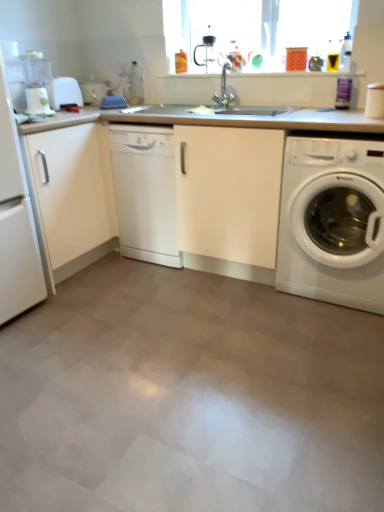
Question: Is white matte countertop at center not close to white matte cabinet at left?

Choices:
 (A) no
 (B) yes

Answer: (A)

Question: Is white matte countertop at center turned away from white matte cabinet at left?

Choices:
 (A) no
 (B) yes

Answer: (A)

Question: From the image's perspective, is white matte countertop at center on white matte cabinet at left?

Choices:
 (A) no
 (B) yes

Answer: (B)

Question: Does white matte countertop at center have a lesser width compared to white matte cabinet at left?

Choices:
 (A) yes
 (B) no

Answer: (B)

Question: Does white matte countertop at center have a greater height compared to white matte cabinet at left?

Choices:
 (A) yes
 (B) no

Answer: (B)

Question: In terms of width, does white glossy washing machine at lower right look wider or thinner when compared to transparent glass window screen at upper center?

Choices:
 (A) thin
 (B) wide

Answer: (B)

Question: From their relative heights in the image, would you say white glossy washing machine at lower right is taller or shorter than transparent glass window screen at upper center?

Choices:
 (A) short
 (B) tall

Answer: (B)

Question: Is point (317, 152) positioned closer to the camera than point (266, 49)?

Choices:
 (A) farther
 (B) closer

Answer: (B)

Question: From the image's perspective, is white glossy washing machine at lower right located above or below transparent glass window screen at upper center?

Choices:
 (A) above
 (B) below

Answer: (B)

Question: From their relative heights in the image, would you say white matte countertop at center is taller or shorter than white plastic toaster at left, marked as the first appliance in a front-to-back arrangement?

Choices:
 (A) tall
 (B) short

Answer: (A)

Question: Considering the positions of white matte countertop at center and white plastic toaster at left, marked as the second appliance in a back-to-front arrangement, in the image, is white matte countertop at center bigger or smaller than white plastic toaster at left, marked as the second appliance in a back-to-front arrangement,?

Choices:
 (A) big
 (B) small

Answer: (A)

Question: From the image's perspective, is white matte countertop at center above or below white plastic toaster at left, marked as the second appliance in a back-to-front arrangement?

Choices:
 (A) below
 (B) above

Answer: (A)

Question: Choose the correct answer: Is white matte countertop at center inside white plastic toaster at left, marked as the first appliance in a front-to-back arrangement, or outside it?

Choices:
 (A) outside
 (B) inside

Answer: (A)

Question: From a real-world perspective, is white plastic toaster at left, marked as the first appliance in a front-to-back arrangement, positioned above or below white glossy dishwasher at center?

Choices:
 (A) above
 (B) below

Answer: (A)

Question: Considering the positions of white plastic toaster at left, marked as the second appliance in a back-to-front arrangement, and white glossy dishwasher at center in the image, is white plastic toaster at left, marked as the second appliance in a back-to-front arrangement, wider or thinner than white glossy dishwasher at center?

Choices:
 (A) wide
 (B) thin

Answer: (B)